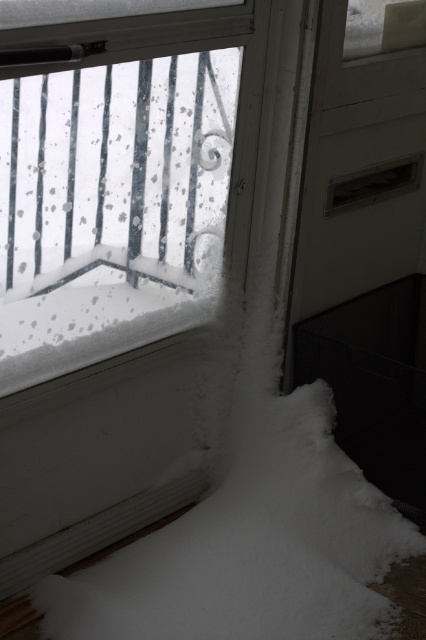
Question: Does white matte screen door at lower right appear under white fluffy snow at lower left?

Choices:
 (A) yes
 (B) no

Answer: (B)

Question: Among these points, which one is nearest to the camera?

Choices:
 (A) (328, 340)
 (B) (317, 384)

Answer: (A)

Question: Does white matte screen door at lower right have a larger size compared to white fluffy snow at lower left?

Choices:
 (A) no
 (B) yes

Answer: (B)

Question: Does white matte screen door at lower right appear over white fluffy snow at lower left?

Choices:
 (A) yes
 (B) no

Answer: (A)

Question: Which object appears closest to the camera in this image?

Choices:
 (A) white fluffy snow at lower left
 (B) white matte screen door at lower right

Answer: (A)